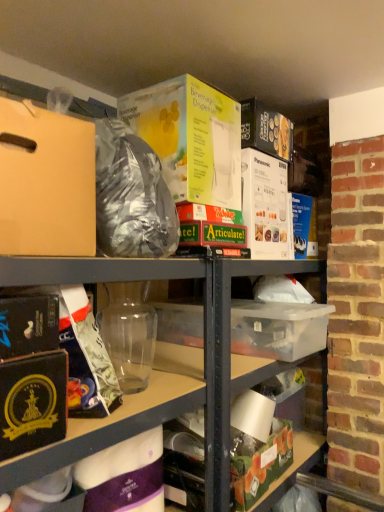
Question: Is black matte book at lower left, placed as the 2th paperback book when sorted from back to front, not close to matte gold wrapping paper at left, arranged as the 1th wrapping paper when viewed from the top?

Choices:
 (A) no
 (B) yes

Answer: (A)

Question: Is black matte book at lower left, which is counted as the second paperback book, starting from the right, to the left of matte gold wrapping paper at left, which is the second wrapping paper from bottom to top, from the viewer's perspective?

Choices:
 (A) yes
 (B) no

Answer: (A)

Question: Considering the relative sizes of black matte book at lower left, which is the 1th paperback book from front to back, and matte gold wrapping paper at left, arranged as the 1th wrapping paper when viewed from the top, in the image provided, is black matte book at lower left, which is the 1th paperback book from front to back, wider than matte gold wrapping paper at left, arranged as the 1th wrapping paper when viewed from the top,?

Choices:
 (A) no
 (B) yes

Answer: (A)

Question: From the image's perspective, is black matte book at lower left, which is the 1th paperback book from front to back, on top of matte gold wrapping paper at left, which is the second wrapping paper from bottom to top?

Choices:
 (A) no
 (B) yes

Answer: (B)

Question: From a real-world perspective, does black matte book at lower left, which is the 1th paperback book from front to back, sit lower than matte gold wrapping paper at left, arranged as the 1th wrapping paper when viewed from the top?

Choices:
 (A) yes
 (B) no

Answer: (B)

Question: Does black matte book at lower left, which is counted as the second paperback book, starting from the right, come in front of matte gold wrapping paper at left, arranged as the 1th wrapping paper when viewed from the top?

Choices:
 (A) no
 (B) yes

Answer: (B)

Question: Considering the relative sizes of black matte book at lower left, placed as the 2th paperback book when sorted from back to front, and purple matte wrapping paper at lower center, which is the 1th wrapping paper in bottom-to-top order, in the image provided, is black matte book at lower left, placed as the 2th paperback book when sorted from back to front, thinner than purple matte wrapping paper at lower center, which is the 1th wrapping paper in bottom-to-top order,?

Choices:
 (A) yes
 (B) no

Answer: (B)

Question: Is black matte book at lower left, acting as the first paperback book starting from the left, oriented towards purple matte wrapping paper at lower center, the 2th wrapping paper when ordered from top to bottom?

Choices:
 (A) no
 (B) yes

Answer: (A)

Question: Considering the relative sizes of black matte book at lower left, placed as the 2th paperback book when sorted from back to front, and purple matte wrapping paper at lower center, the 2th wrapping paper when ordered from top to bottom, in the image provided, is black matte book at lower left, placed as the 2th paperback book when sorted from back to front, wider than purple matte wrapping paper at lower center, the 2th wrapping paper when ordered from top to bottom,?

Choices:
 (A) yes
 (B) no

Answer: (A)

Question: Is purple matte wrapping paper at lower center, which is the 1th wrapping paper in bottom-to-top order, completely or partially inside black matte book at lower left, placed as the 2th paperback book when sorted from back to front?

Choices:
 (A) yes
 (B) no

Answer: (B)

Question: Is black matte book at lower left, the first paperback book positioned from the bottom, completely or partially outside of purple matte wrapping paper at lower center, the 2th wrapping paper when ordered from top to bottom?

Choices:
 (A) yes
 (B) no

Answer: (A)

Question: Can you confirm if black matte book at lower left, acting as the 2th paperback book starting from the top, is shorter than purple matte wrapping paper at lower center, which is the 1th wrapping paper in bottom-to-top order?

Choices:
 (A) yes
 (B) no

Answer: (A)

Question: From a real-world perspective, is black matte book at lower left, the first paperback book positioned from the bottom, below green matte box at lower center?

Choices:
 (A) no
 (B) yes

Answer: (A)